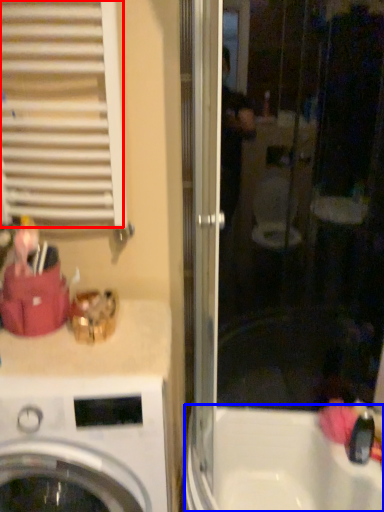
Question: Which of the following is the farthest to the observer, shutter (highlighted by a red box) or bath (highlighted by a blue box)?

Choices:
 (A) shutter
 (B) bath

Answer: (B)